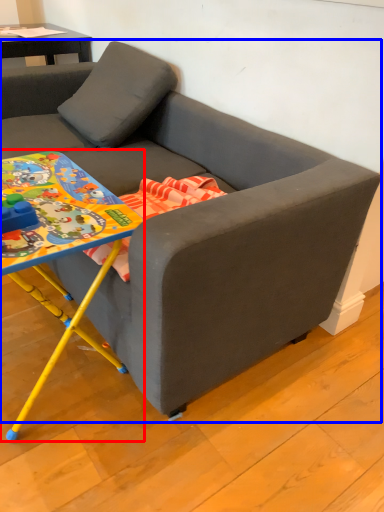
Question: Among these objects, which one is nearest to the camera, table (highlighted by a red box) or studio couch (highlighted by a blue box)?

Choices:
 (A) table
 (B) studio couch

Answer: (B)